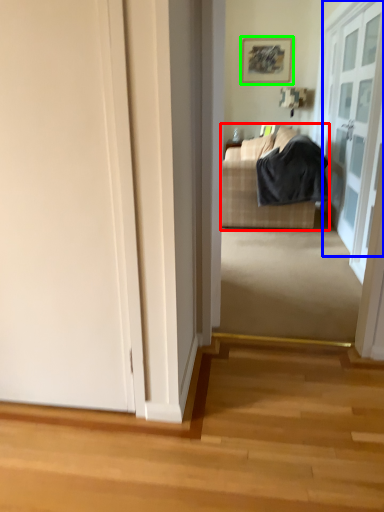
Question: Which object is the farthest from studio couch (highlighted by a red box)? Choose among these: door (highlighted by a blue box) or picture frame (highlighted by a green box).

Choices:
 (A) door
 (B) picture frame

Answer: (B)